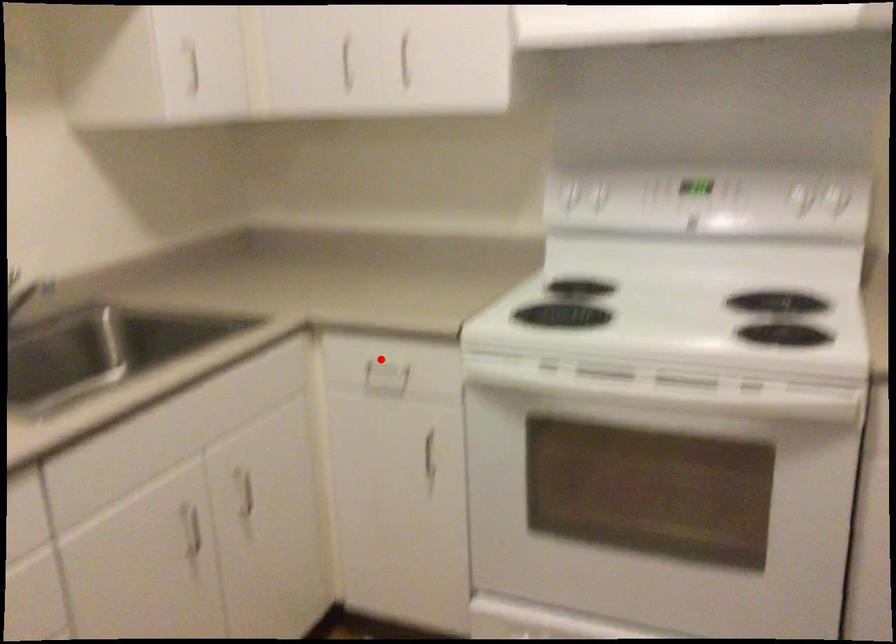
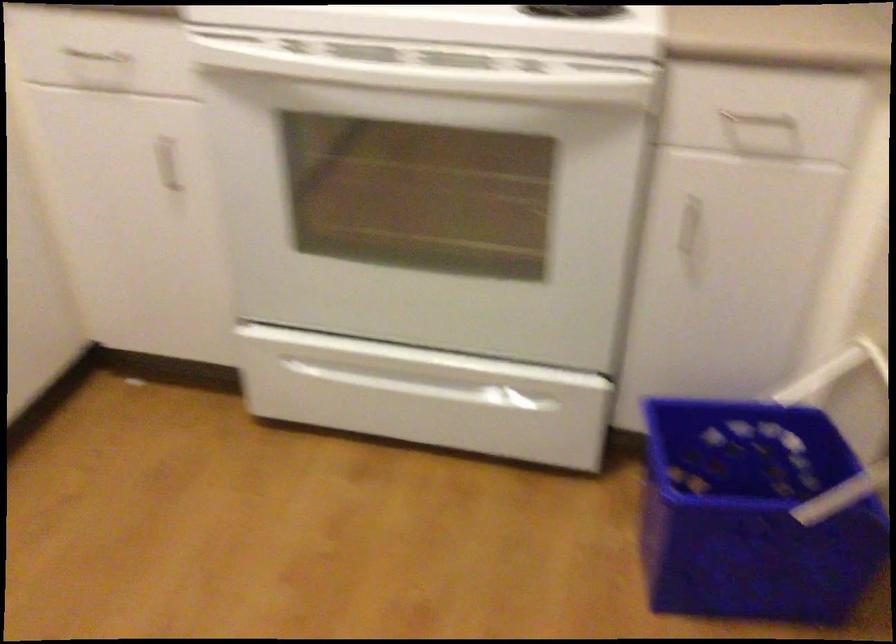
Locate, in the second image, the point that corresponds to the highlighted location in the first image.

(97, 57)